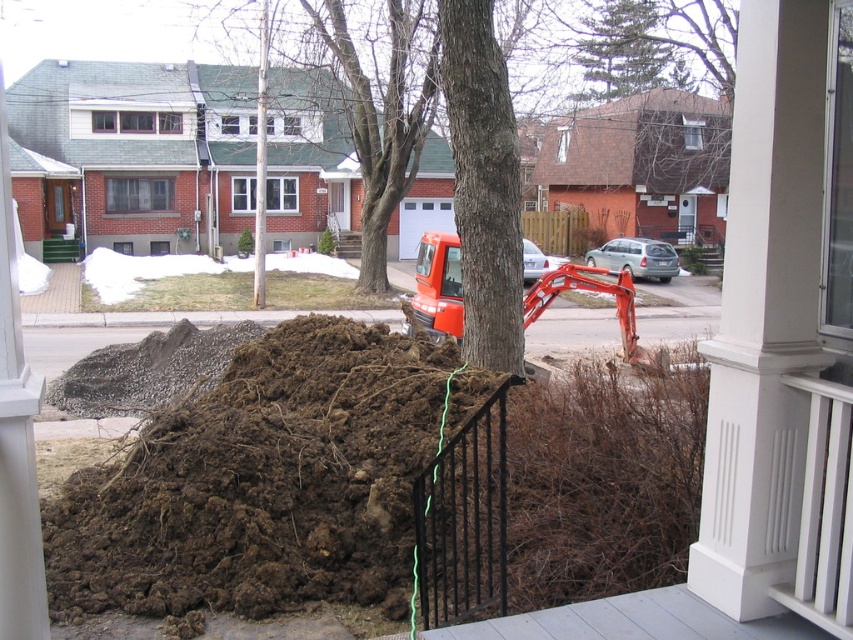
Question: Which object appears farthest from the camera in this image?

Choices:
 (A) brown bark tree at center
 (B) green textured pine tree at upper center
 (C) smooth bark tree at center

Answer: (B)

Question: Estimate the real-world distances between objects in this image. Which object is closer to the brown bark tree at center?

Choices:
 (A) orange rubber excavator at center
 (B) brown soil at lower left

Answer: (A)

Question: Is brown bark tree at center smaller than green textured pine tree at upper center?

Choices:
 (A) yes
 (B) no

Answer: (B)

Question: Considering the relative positions of brown soil at lower left and smooth bark tree at center in the image provided, where is brown soil at lower left located with respect to smooth bark tree at center?

Choices:
 (A) left
 (B) right

Answer: (A)

Question: Among these objects, which one is nearest to the camera?

Choices:
 (A) black metal fence at lower center
 (B) brown bark tree at center
 (C) smooth bark tree at center
 (D) orange rubber excavator at center

Answer: (A)

Question: Is brown bark tree at center positioned before green textured pine tree at upper center?

Choices:
 (A) no
 (B) yes

Answer: (B)